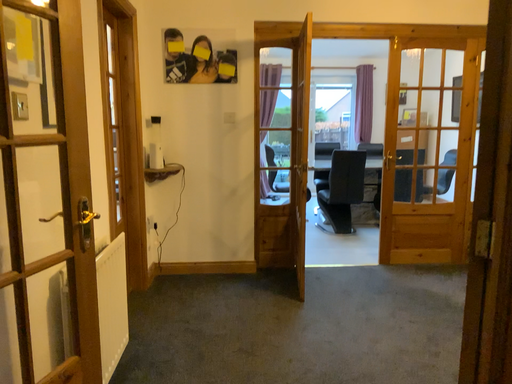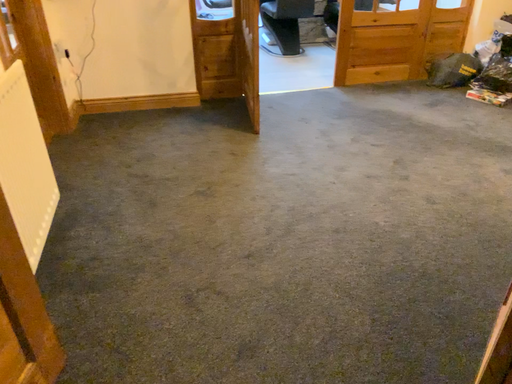
Question: Which way did the camera rotate in the video?

Choices:
 (A) rotated right
 (B) rotated left

Answer: (A)